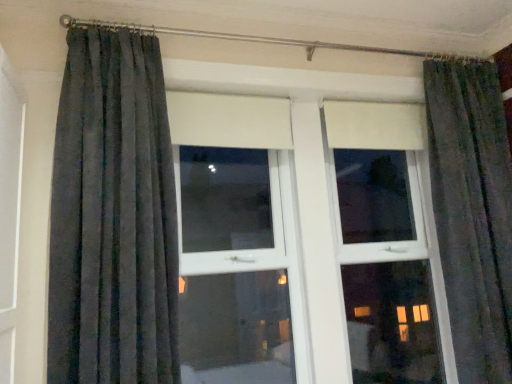
In order to click on dark grey textured curtain at left in this screenshot , I will do `click(113, 217)`.

This screenshot has width=512, height=384. What do you see at coordinates (113, 217) in the screenshot?
I see `dark grey textured curtain at left` at bounding box center [113, 217].

In order to face dark grey textured curtain at left, should I rotate leftwards or rightwards?

It's best to rotate left around 18.611 degrees.

The image size is (512, 384). What do you see at coordinates (315, 209) in the screenshot?
I see `matte gray curtains at center` at bounding box center [315, 209].

What are the coordinates of `matte gray curtains at center` in the screenshot? It's located at [x=315, y=209].

In order to click on dark grey textured curtain at left in this screenshot , I will do `click(113, 217)`.

Considering the relative positions of dark grey textured curtain at left and matte gray curtains at center in the image provided, is dark grey textured curtain at left to the left of matte gray curtains at center from the viewer's perspective?

Correct, you'll find dark grey textured curtain at left to the left of matte gray curtains at center.

Is dark grey textured curtain at left further to camera compared to matte gray curtains at center?

No, dark grey textured curtain at left is in front of matte gray curtains at center.

Between point (172, 294) and point (192, 136), which one is positioned in front?

The point (172, 294) is closer.

From the image's perspective, between dark grey textured curtain at left and matte gray curtains at center, which one is located above?

dark grey textured curtain at left is shown above in the image.

Based on the photo, from a real-world perspective, relative to matte gray curtains at center, is dark grey textured curtain at left vertically above or below?

Clearly, from a real-world perspective, dark grey textured curtain at left is above matte gray curtains at center.

Looking at their sizes, would you say dark grey textured curtain at left is wider or thinner than matte gray curtains at center?

Clearly, dark grey textured curtain at left has less width compared to matte gray curtains at center.

Looking at this image, in terms of height, does dark grey textured curtain at left look taller or shorter compared to matte gray curtains at center?

Considering their sizes, dark grey textured curtain at left has less height than matte gray curtains at center.

Who is smaller, dark grey textured curtain at left or matte gray curtains at center?

dark grey textured curtain at left.

Is matte gray curtains at center a part of dark grey textured curtain at left?

No, matte gray curtains at center is not inside dark grey textured curtain at left.

Looking at this image, is dark grey textured curtain at left directly adjacent to matte gray curtains at center?

No, dark grey textured curtain at left is not making contact with matte gray curtains at center.

Does dark grey textured curtain at left turn towards matte gray curtains at center?

No.

Measure the distance from dark grey textured curtain at left to matte gray curtains at center.

A distance of 27.66 inches exists between dark grey textured curtain at left and matte gray curtains at center.

Identify the location of bay window behind the dark grey textured curtain at left. (315, 209).

Does matte gray curtains at center appear on the right side of dark grey textured curtain at left?

Correct, you'll find matte gray curtains at center to the right of dark grey textured curtain at left.

Considering the positions of objects matte gray curtains at center and dark grey textured curtain at left in the image provided, who is in front, matte gray curtains at center or dark grey textured curtain at left?

Positioned in front is dark grey textured curtain at left.

Which point is more distant from viewer, (415,226) or (53,327)?

The point (415,226) is behind.

From the image's perspective, which object appears higher, matte gray curtains at center or dark grey textured curtain at left?

From the image's view, dark grey textured curtain at left is above.

From a real-world perspective, which object stands above the other?

dark grey textured curtain at left, from a real-world perspective.

Considering the sizes of objects matte gray curtains at center and dark grey textured curtain at left in the image provided, who is wider, matte gray curtains at center or dark grey textured curtain at left?

Wider between the two is matte gray curtains at center.

Can you confirm if matte gray curtains at center is taller than dark grey textured curtain at left?

Correct, matte gray curtains at center is much taller as dark grey textured curtain at left.

Who is smaller, matte gray curtains at center or dark grey textured curtain at left?

dark grey textured curtain at left is smaller.

Is matte gray curtains at center not within dark grey textured curtain at left?

Yes.

Would you consider matte gray curtains at center to be distant from dark grey textured curtain at left?

No, matte gray curtains at center is not far from dark grey textured curtain at left.

Is matte gray curtains at center oriented towards dark grey textured curtain at left?

No, matte gray curtains at center does not turn towards dark grey textured curtain at left.

From the picture: Can you tell me how much matte gray curtains at center and dark grey textured curtain at left differ in facing direction?

The angular difference between matte gray curtains at center and dark grey textured curtain at left is 1.54 degrees.

Measure the distance from matte gray curtains at center to dark grey textured curtain at left.

matte gray curtains at center is 70.27 centimeters away from dark grey textured curtain at left.

Find the location of a particular element. The image size is (512, 384). bay window behind the dark grey textured curtain at left is located at coordinates (315, 209).

Identify the location of bay window behind the dark grey textured curtain at left. (315, 209).

This screenshot has height=384, width=512. In order to click on bay window that is below the dark grey textured curtain at left (from the image's perspective) in this screenshot , I will do `click(315, 209)`.